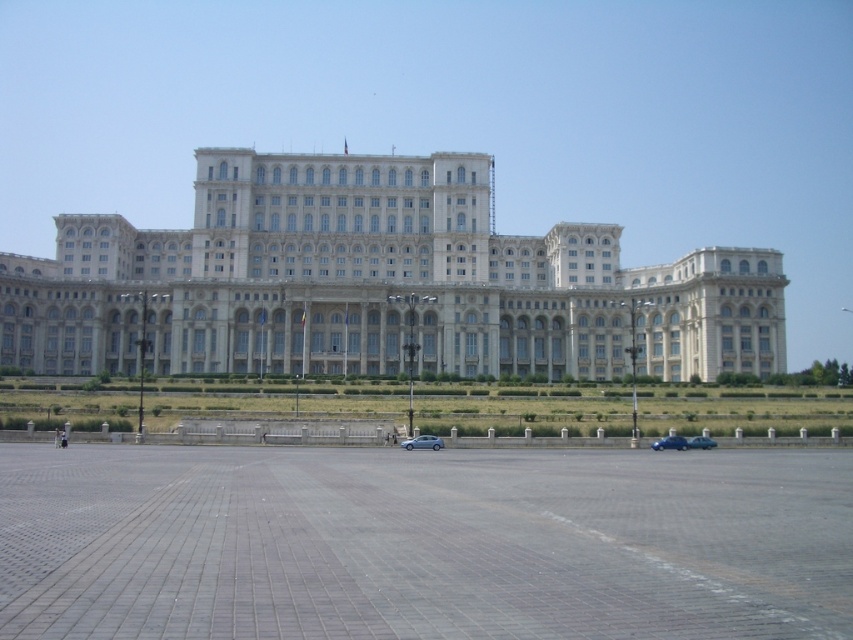
Who is shorter, gray brick plaza at center or teal glossy car at center?

With less height is teal glossy car at center.

Which is in front, point (369, 611) or point (704, 444)?

Positioned in front is point (369, 611).

Which is behind, point (721, 529) or point (694, 436)?

Point (694, 436)

This screenshot has height=640, width=853. What are the coordinates of `gray brick plaza at center` in the screenshot? It's located at (422, 544).

Who is lower down, white stone building at center or blue metallic car at lower right?

blue metallic car at lower right is lower down.

Does white stone building at center have a lesser width compared to blue metallic car at lower right?

In fact, white stone building at center might be wider than blue metallic car at lower right.

At what (x,y) coordinates should I click in order to perform the action: click on white stone building at center. Please return your answer as a coordinate pair (x, y). The image size is (853, 640). Looking at the image, I should click on (376, 284).

Describe the element at coordinates (422, 442) in the screenshot. I see `satin blue sedan at center` at that location.

Is point (409, 442) closer to camera compared to point (675, 449)?

Yes, point (409, 442) is in front of point (675, 449).

At what (x,y) coordinates should I click in order to perform the action: click on satin blue sedan at center. Please return your answer as a coordinate pair (x, y). Image resolution: width=853 pixels, height=640 pixels. Looking at the image, I should click on (422, 442).